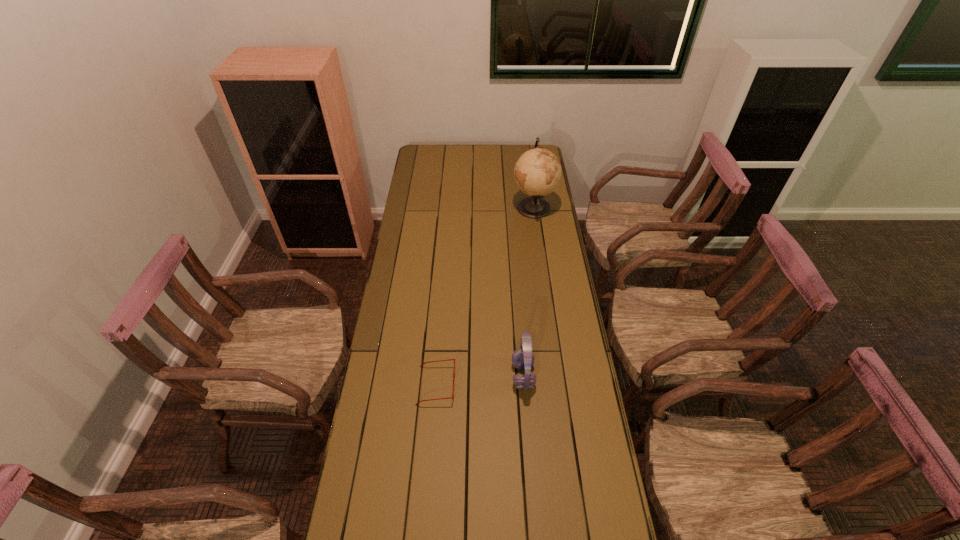
Locate an element on the screen. vacant space located on the headband and ear cups of the headset is located at coordinates (397, 375).

Image resolution: width=960 pixels, height=540 pixels. What are the coordinates of `vacant region located 0.060m on the face of the leftmost object` in the screenshot? It's located at (472, 385).

This screenshot has height=540, width=960. What are the coordinates of `object that is at the left edge` in the screenshot? It's located at (448, 359).

Where is `object positioned at the right edge`? This screenshot has height=540, width=960. object positioned at the right edge is located at coordinates (537, 172).

This screenshot has width=960, height=540. I want to click on vacant region at the far edge of the desktop, so coord(476,147).

This screenshot has width=960, height=540. In order to click on blank space at the left edge of the desktop in this screenshot , I will do `click(400, 240)`.

Image resolution: width=960 pixels, height=540 pixels. In the image, there is a desktop. In order to click on vacant region at the right edge in this screenshot , I will do (x=574, y=494).

Where is `empty space that is in between the farthest object and the headset`? This screenshot has height=540, width=960. empty space that is in between the farthest object and the headset is located at coordinates (528, 292).

Identify the location of free space between the tallest object and the leftmost object. The width and height of the screenshot is (960, 540). (485, 296).

You are a GUI agent. You are given a task and a screenshot of the screen. Output one action in this format:
    pyautogui.click(x=<x>, y=<y>)
    Task: Click on the free space between the farthest object and the spectacles
    The image size is (960, 540).
    Given the screenshot: What is the action you would take?
    pyautogui.click(x=485, y=296)